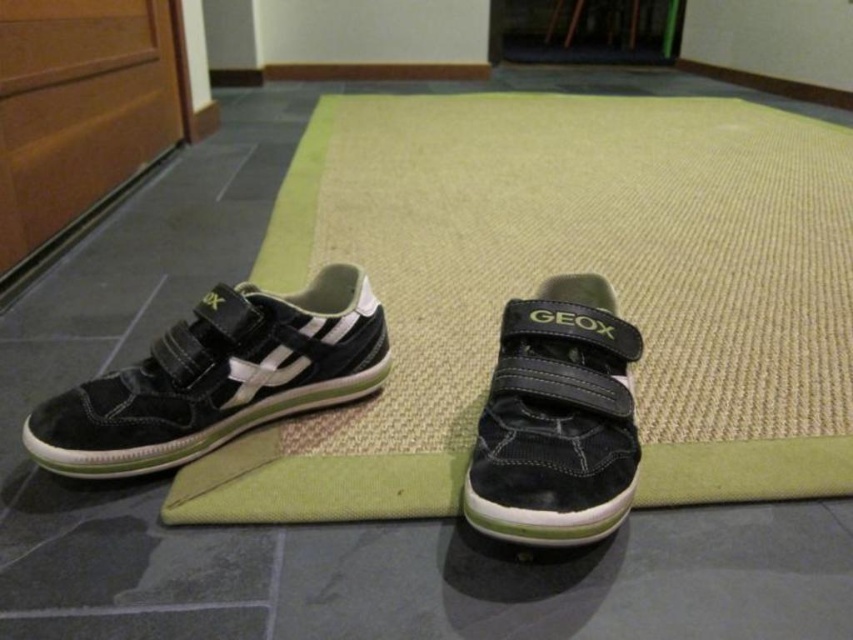
Question: Which point is closer to the camera?

Choices:
 (A) (837, 445)
 (B) (161, 416)
 (C) (585, 500)

Answer: (C)

Question: Which object appears closest to the camera in this image?

Choices:
 (A) green woven mat at center
 (B) suede/black sneaker at center
 (C) suede/black velcro strap sneaker at left

Answer: (B)

Question: Is green woven mat at center to the left of suede/black velcro strap sneaker at left from the viewer's perspective?

Choices:
 (A) no
 (B) yes

Answer: (A)

Question: Which of the following is the closest to the observer?

Choices:
 (A) green woven mat at center
 (B) suede/black velcro strap sneaker at left
 (C) suede/black sneaker at center

Answer: (C)

Question: Does suede/black velcro strap sneaker at left have a greater width compared to suede/black sneaker at center?

Choices:
 (A) no
 (B) yes

Answer: (B)

Question: Is suede/black velcro strap sneaker at left above suede/black sneaker at center?

Choices:
 (A) yes
 (B) no

Answer: (B)